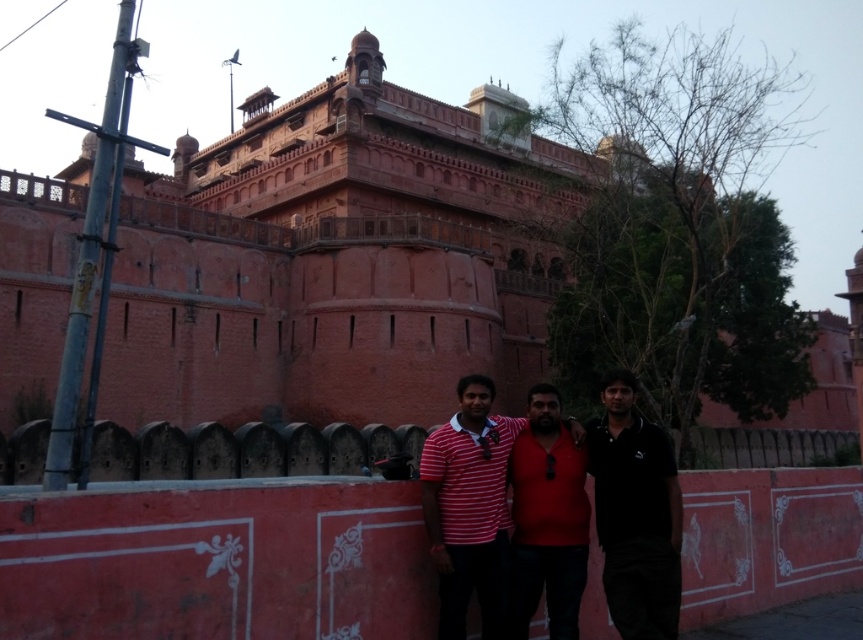
Question: Which point appears closest to the camera in this image?

Choices:
 (A) (646, 432)
 (B) (542, 554)
 (C) (583, 544)

Answer: (C)

Question: Considering the relative positions of red striped shirt at center and matte red shirt at center in the image provided, where is red striped shirt at center located with respect to matte red shirt at center?

Choices:
 (A) right
 (B) left

Answer: (B)

Question: Is red striped shirt at center below black matte shirt at center?

Choices:
 (A) no
 (B) yes

Answer: (B)

Question: Among these points, which one is farthest from the camera?

Choices:
 (A) click(578, 602)
 (B) click(543, 528)
 (C) click(632, 417)

Answer: (C)

Question: Is the position of red striped shirt at center more distant than that of matte red shirt at center?

Choices:
 (A) no
 (B) yes

Answer: (A)

Question: Which of the following is the closest to the observer?

Choices:
 (A) matte red shirt at center
 (B) red striped shirt at center
 (C) black matte shirt at center

Answer: (C)